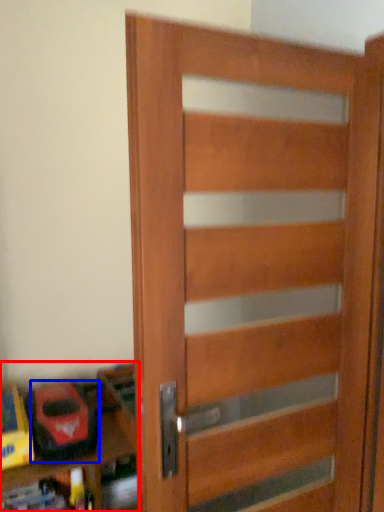
Question: Which of the following is the farthest to the observer, shelf (highlighted by a red box) or toy (highlighted by a blue box)?

Choices:
 (A) shelf
 (B) toy

Answer: (B)